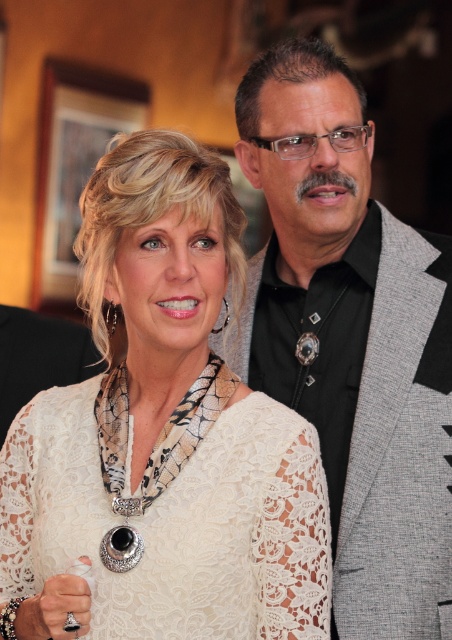
You are a photographer standing 1.5 meters away from the white lace dress at center. Can you reach the dress to adjust its position without moving closer?

The white lace dress at center is only 1.41 meters away from the viewer, which is closer than your current position of 1.5 meters. Therefore, you can reach it without moving closer.

You are taking a photo of two people at a social gathering. You notice two points in the image labeled as point (193,355) and point (328,154). Which point is closer to the camera?

Point (193,355) is closer to the camera than point (328,154).